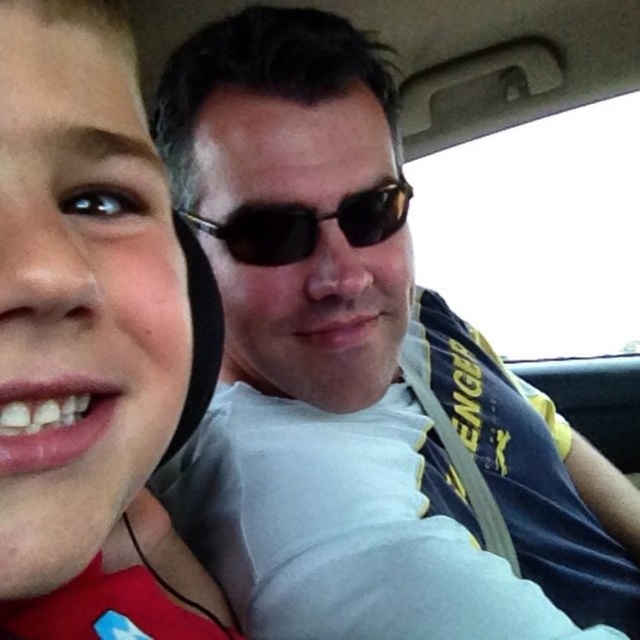
You are taking a photo of two points in the image. The first point is at coordinates point (83, 625) and the second is at point (307, 216). Which point will appear larger in your photo?

Point (83, 625) is closer to the camera than point (307, 216), so it will appear larger in the photo.

You are a fashion designer analyzing the image of two people in a car. You need to determine which item, the matte black hoodie at left or the black plastic sunglasses at center, has a smaller width. Which one is narrower?

The matte black hoodie at left is thinner than the black plastic sunglasses at center, so the matte black hoodie at left has a smaller width.

You are designing a storage box for the items in the vehicle. The matte black hoodie at left and the black plastic sunglasses at center need to be stored. Which item requires a larger compartment?

The matte black hoodie at left requires a larger compartment because it is larger in size than the black plastic sunglasses at center.